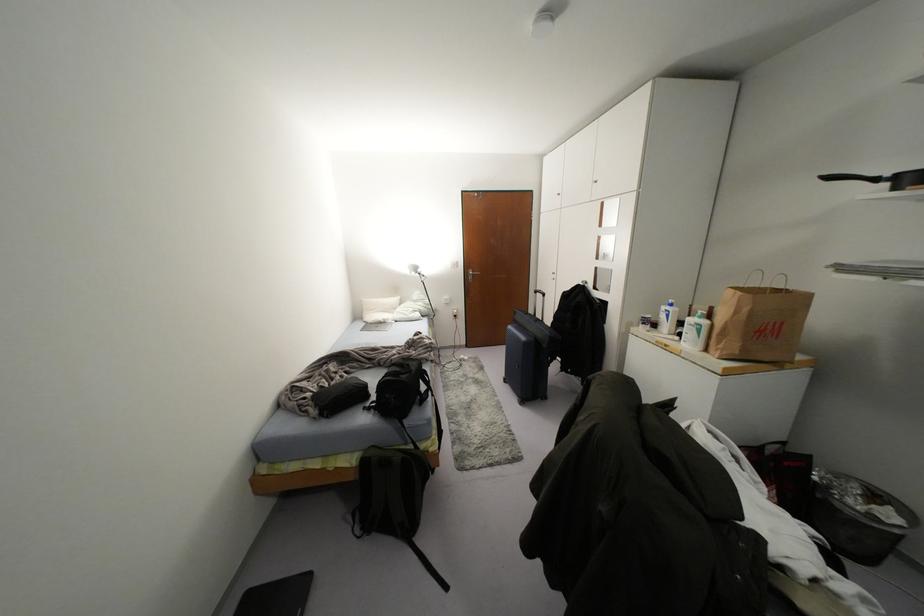
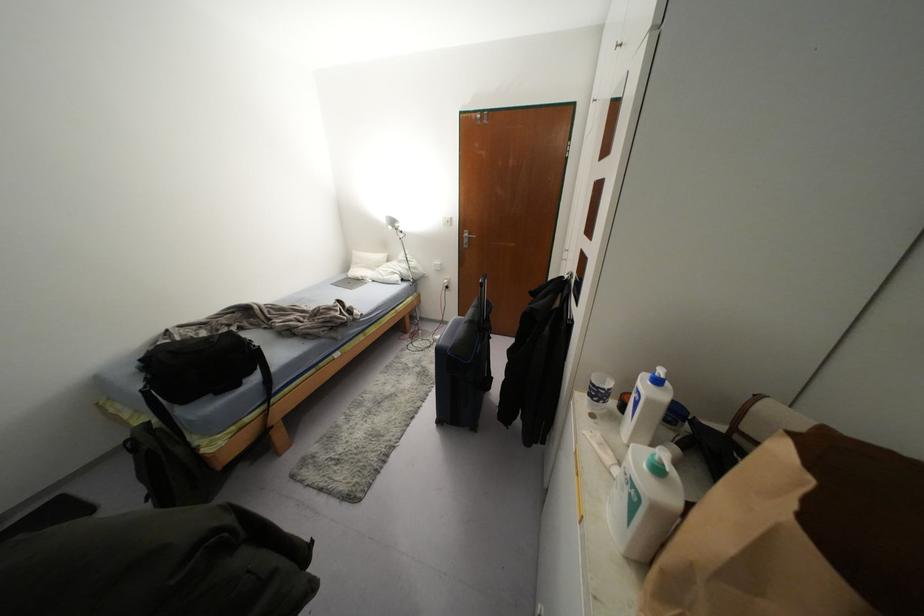
Where in the second image is the point corresponding to the point at 394,299 from the first image?

(382, 256)